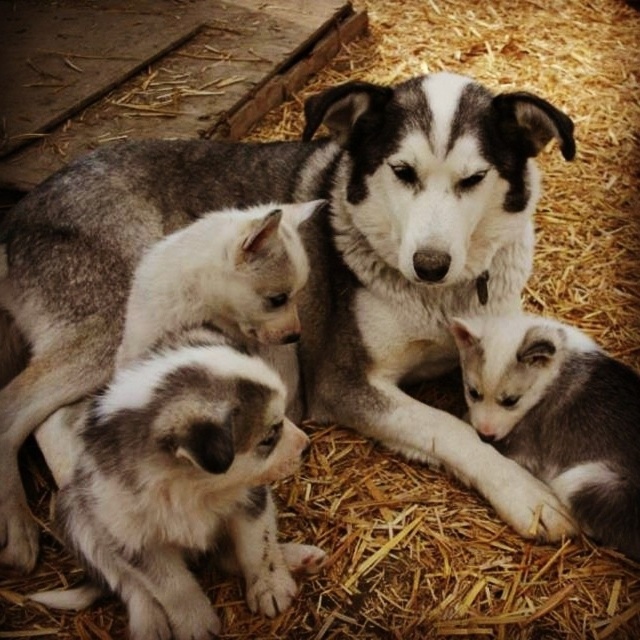
You are a photographer trying to capture a closeup of the gray and white fur puppy at lower left. The camera you are using has a focal length of 50mm. To ensure the puppy fills the frame, you need to position yourself at a distance where the puppy occupies 80 percent of the frame height. Given that the puppy is at point [184,483], can you determine if you should move closer or farther away from the puppy?

The point [184,483] marks the gray and white fur puppy at lower left. Since the photographer needs the puppy to occupy 80 percent of the frame height, and the current position is at point [184,483], moving closer would increase the puppy size in the frame. Therefore, the photographer should move closer to the puppy to achieve the desired framing.

You are a photographer trying to capture a closeup of the gray and white fur dog at center and the golden straw bed at center. Based on their positions, which object will appear larger in the photo?

The gray and white fur dog at center will appear larger in the photo because it is closer to the viewer than the golden straw bed at center.

You are a new puppy in the scene. You want to move from the gray fur puppy at lower right to the golden straw bed at center. Can you fit comfortably on the bed without overlapping the edges?

The golden straw bed at center is wider than the gray fur puppy at lower right, so yes, the puppy can fit comfortably on the bed without overlapping the edges since the bed is wider than the puppy.